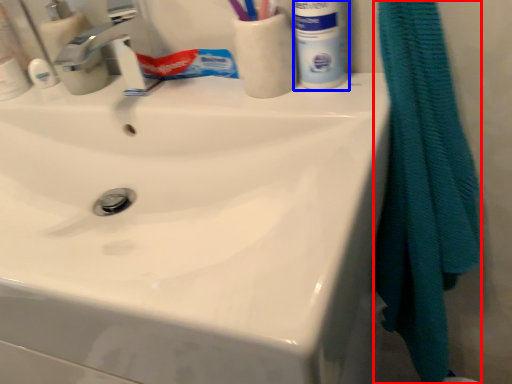
Question: Which of the following is the farthest to the observer, bath towel (highlighted by a red box) or mouthwash (highlighted by a blue box)?

Choices:
 (A) bath towel
 (B) mouthwash

Answer: (B)